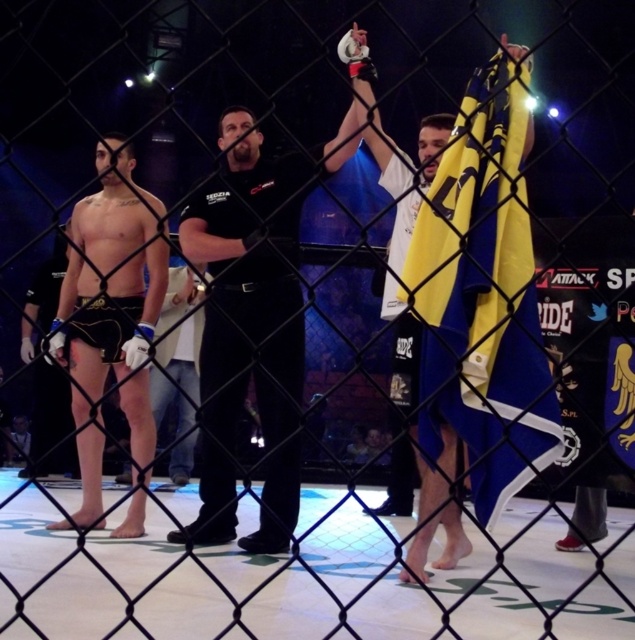
Question: Which of the following is the farthest from the observer?

Choices:
 (A) (57, 339)
 (B) (265, 500)

Answer: (A)

Question: Is the position of black matte referee at center less distant than that of matte black shorts at center?

Choices:
 (A) yes
 (B) no

Answer: (B)

Question: From the image, what is the correct spatial relationship of black matte referee at center in relation to matte black shorts at center?

Choices:
 (A) above
 (B) below

Answer: (B)

Question: Which object appears farthest from the camera in this image?

Choices:
 (A) black matte referee at center
 (B) matte black shorts at center

Answer: (A)

Question: Which of the following is the closest to the observer?

Choices:
 (A) (131, 198)
 (B) (203, 412)

Answer: (B)

Question: Does black matte referee at center have a smaller size compared to matte black shorts at center?

Choices:
 (A) yes
 (B) no

Answer: (A)